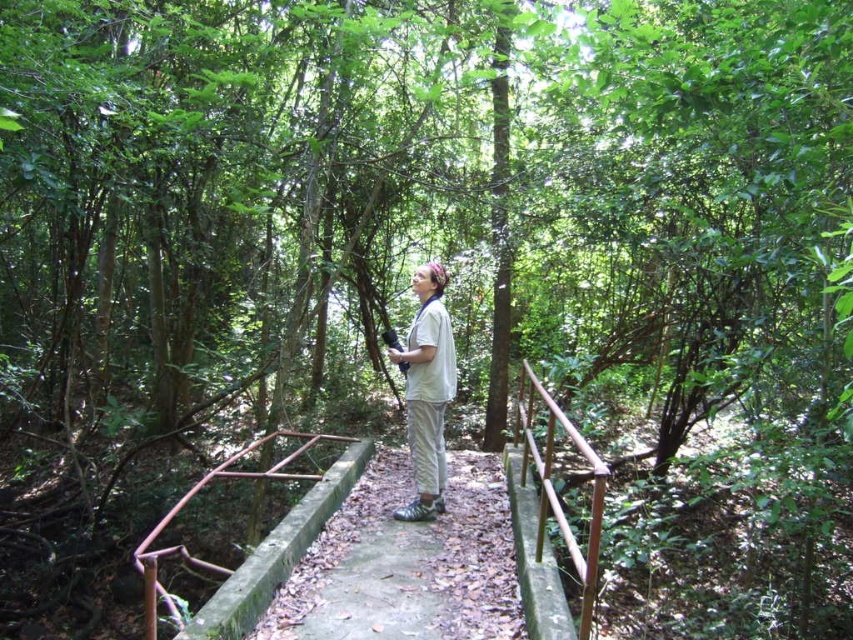
You are a hiker who needs to cross the narrow bridge. The concrete at center and brown wooden rail at center are the only structures available. Which structure is wider, allowing you to walk safely?

The concrete at center is wider than the brown wooden rail at center, so you can walk safely on the concrete at center.